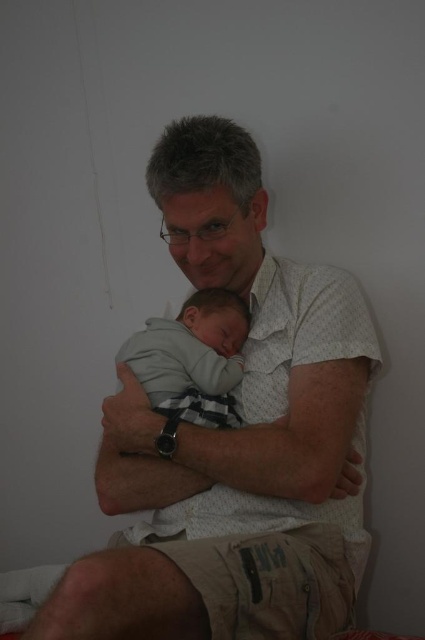
You are a photographer trying to capture the man and the baby in the image. You need to focus on the white textured shirt at center. What are the coordinates where you should aim your camera?

You should aim your camera at the coordinates point (232,436) where the white textured shirt at center is located.

Consider the image. You are a photographer setting up a closeup shot of the man and baby. You need to ensure that both the white textured shirt at center and the gray soft fabric baby at center are in focus. Given that your camera has a depth of field that can cover objects within 12 centimeters of each other, will both subjects be in focus?

The white textured shirt at center is 13.09 centimeters away from the gray soft fabric baby at center. Since the distance between them exceeds the camera sensor depth of field limit of 12 centimeters, the two subjects cannot both be in focus simultaneously.